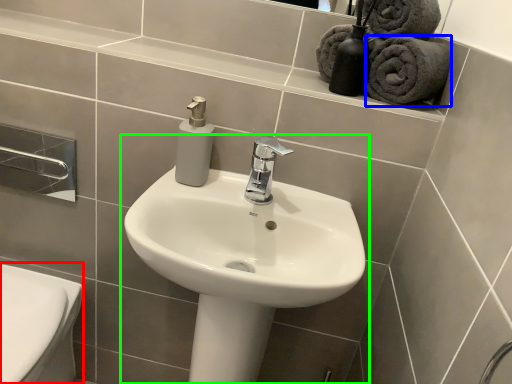
Question: Considering the real-world distances, which object is farthest from bidet (highlighted by a red box)? bath towel (highlighted by a blue box) or sink (highlighted by a green box)?

Choices:
 (A) bath towel
 (B) sink

Answer: (A)